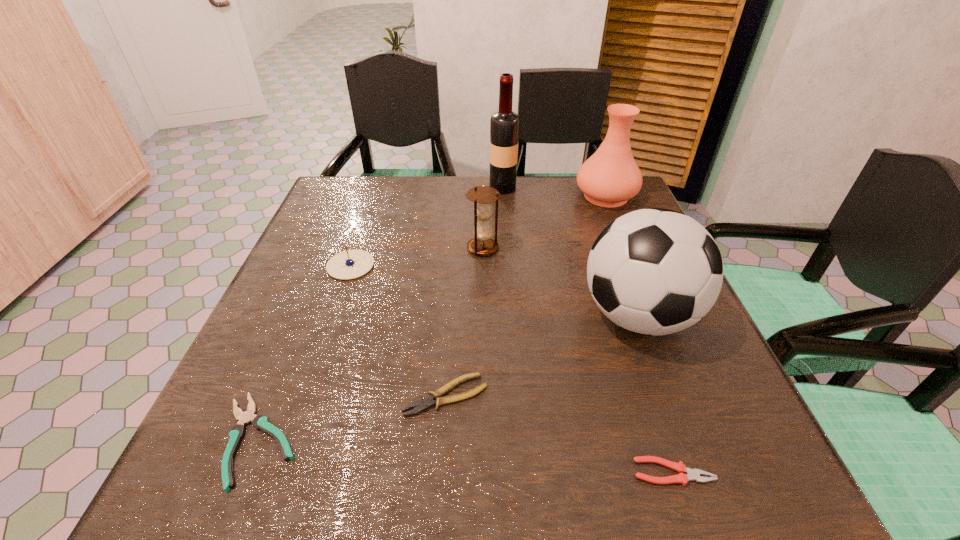
Image resolution: width=960 pixels, height=540 pixels. Identify the location of vacant region located on the left of the soccer ball. (412, 316).

At what (x,y) coordinates should I click in order to perform the action: click on free space located 0.060m on the right of the fifth shortest object. Please return your answer as a coordinate pair (x, y). Image resolution: width=960 pixels, height=540 pixels. Looking at the image, I should click on (523, 248).

Where is `free space located on the front of the compass`? free space located on the front of the compass is located at coordinates (294, 429).

I want to click on vacant area situated on the back of the second pliers from right to left, so click(456, 241).

Locate an element on the screen. vacant space located 0.290m on the back of the rightmost pliers is located at coordinates (622, 319).

Locate an element on the screen. blank area located 0.220m on the back of the leftmost pliers is located at coordinates (313, 305).

You are a GUI agent. You are given a task and a screenshot of the screen. Output one action in this format:
    pyautogui.click(x=<x>, y=<y>)
    Task: Click on the wine bottle located at the far edge
    
    Given the screenshot: What is the action you would take?
    pyautogui.click(x=504, y=124)

Image resolution: width=960 pixels, height=540 pixels. Identify the location of vase that is positioned at the far edge. tap(610, 177).

Where is `compass at the left edge`? compass at the left edge is located at coordinates click(350, 264).

This screenshot has width=960, height=540. What are the coordinates of `pliers that is positioned at the left edge` in the screenshot? It's located at (260, 422).